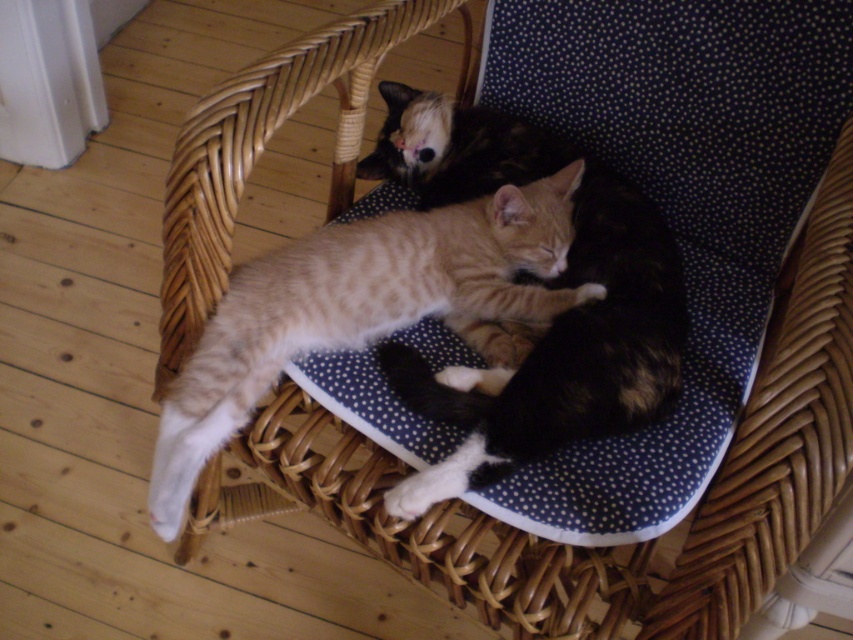
You are a photographer trying to capture both cats in a single frame. Since the tabby fur cat at center and the striped fur cat at center are different in size, which cat would require more space in the photo to avoid cropping?

The striped fur cat at center requires more space in the photo because it has a greater width than the tabby fur cat at center, so the photo should be framed to accommodate its larger size to avoid cropping.

Looking at the two cats on the woven wicker chair with a blue and white cushion, which cat is positioned higher up between the tabby fur cat at center and the striped fur cat at center?

The tabby fur cat at center is positioned higher up than the striped fur cat at center according to the description.